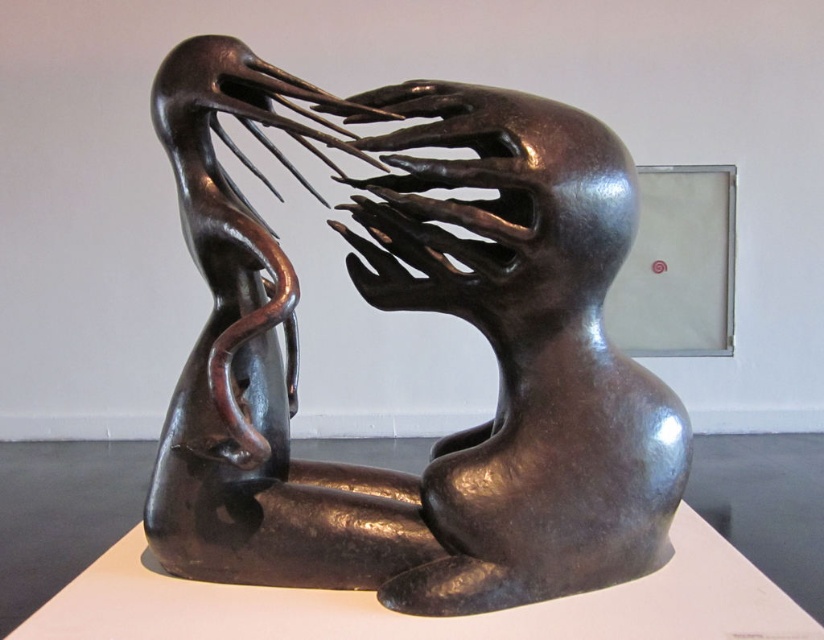
You are an art critic standing in front of the sculpture. You notice two parts of the sculpture labeled as the shiny bronze sculpture at center and the shiny metallic head at center. From your perspective, which part is positioned more to the left?

The shiny bronze sculpture at center is positioned more to the left than the shiny metallic head at center.

You are an art curator planning to install a new light fixture in the gallery. The light fixture needs to be placed at a height that can illuminate both the shiny bronze sculpture at center and the shiny metallic head at center without casting shadows. Considering their heights, which object requires the light to be placed higher to avoid its shadow?

The shiny bronze sculpture at center is much taller than the shiny metallic head at center, so the light should be placed higher to avoid the shadow of the shiny bronze sculpture at center.

You are standing in an art gallery and want to take a photo of the shiny bronze sculpture at center. If you are positioned at point 0.5, 0.5, which is the exact center of the room, will you be directly in front of the sculpture?

The shiny bronze sculpture at center is located at point (415,308), which is very close to the center point (412,320). Therefore, standing at the exact center would place you directly in front of the sculpture.